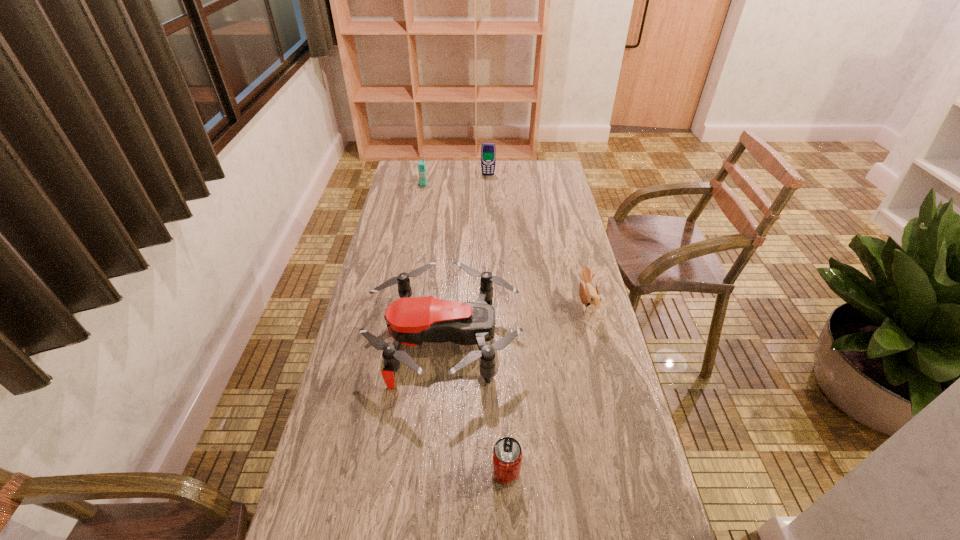
Locate an element on the screen. vacant space at the right edge of the desktop is located at coordinates (546, 274).

Where is `free space between the farther cellular telephone and the pop soda`? free space between the farther cellular telephone and the pop soda is located at coordinates (497, 324).

The width and height of the screenshot is (960, 540). Identify the location of vacant area that lies between the left cellular telephone and the rightmost object. (505, 245).

Where is `free space between the pop soda and the drone`? The width and height of the screenshot is (960, 540). free space between the pop soda and the drone is located at coordinates (475, 406).

This screenshot has height=540, width=960. What are the coordinates of `free space between the drone and the pop soda` in the screenshot? It's located at (475, 406).

Identify the location of free area in between the right cellular telephone and the nearest object. Image resolution: width=960 pixels, height=540 pixels. (497, 324).

Locate an element on the screen. vacant area that lies between the farthest object and the drone is located at coordinates (467, 257).

This screenshot has height=540, width=960. What are the coordinates of `vacant area that lies between the bird and the nearest object` in the screenshot? It's located at (546, 389).

What are the coordinates of `object that stands as the third closest to the right cellular telephone` in the screenshot? It's located at (590, 297).

This screenshot has width=960, height=540. I want to click on object that is the third nearest to the drone, so click(x=421, y=164).